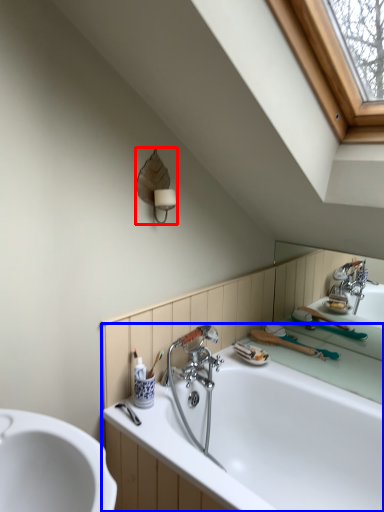
Question: Which point is further to the camera, fixture (highlighted by a red box) or bathtub (highlighted by a blue box)?

Choices:
 (A) fixture
 (B) bathtub

Answer: (A)